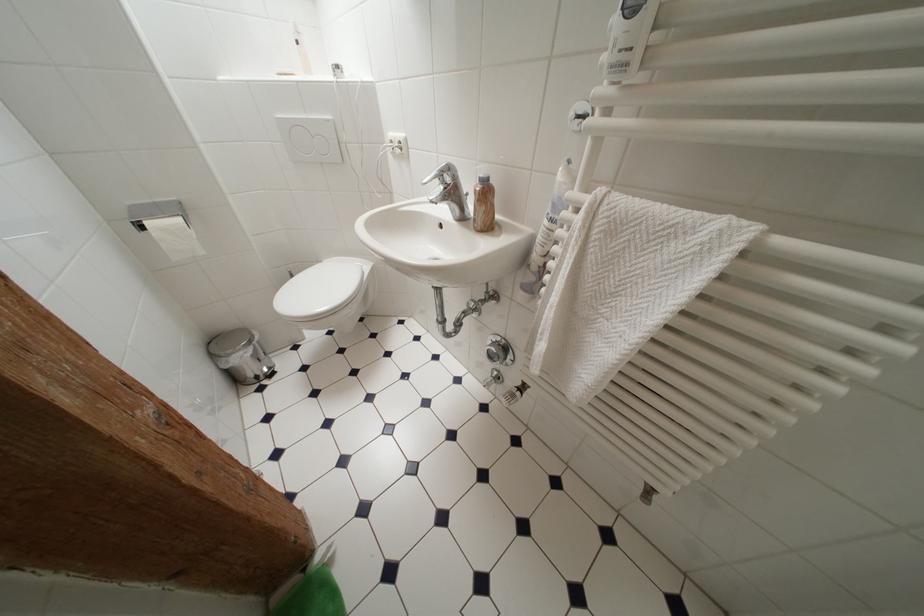
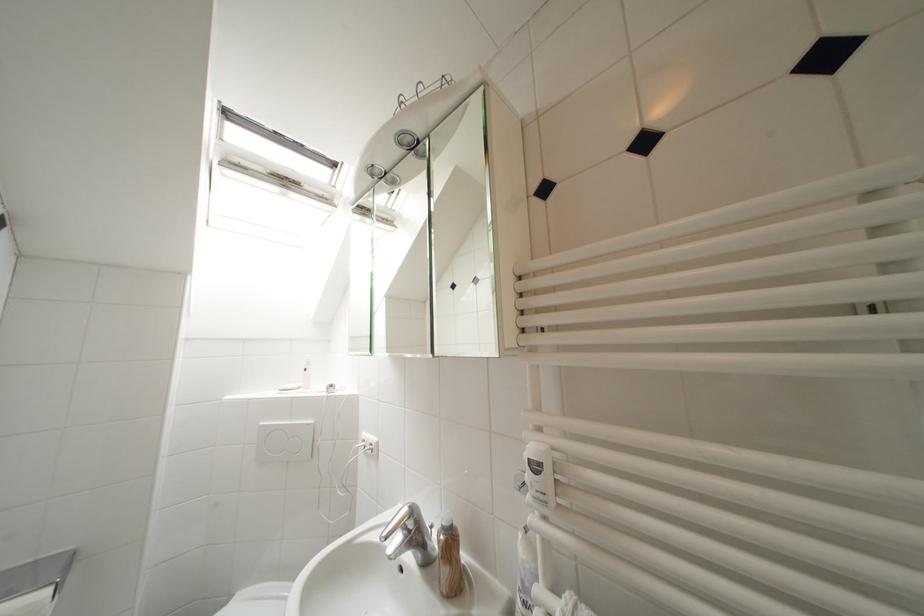
Question: How did the camera likely rotate?

Choices:
 (A) Left
 (B) Right
 (C) Up
 (D) Down

Answer: (C)